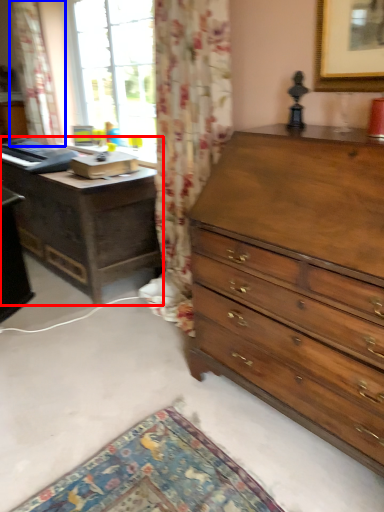
Question: Which point is further to the camera, nightstand (highlighted by a red box) or curtain (highlighted by a blue box)?

Choices:
 (A) nightstand
 (B) curtain

Answer: (B)